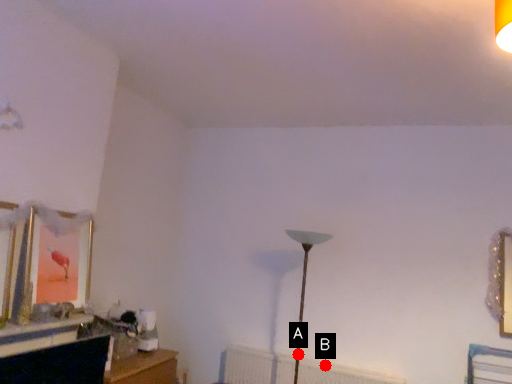
Question: Two points are circled on the image, labeled by A and B beside each circle. Among these points, which one is farthest from the camera?

Choices:
 (A) A is further
 (B) B is further

Answer: (B)